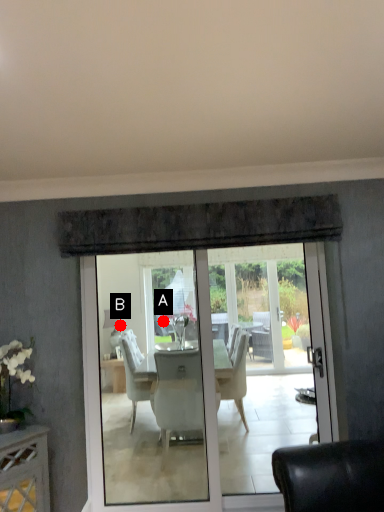
Question: Two points are circled on the image, labeled by A and B beside each circle. Which point is farther to the camera?

Choices:
 (A) A is further
 (B) B is further

Answer: (B)